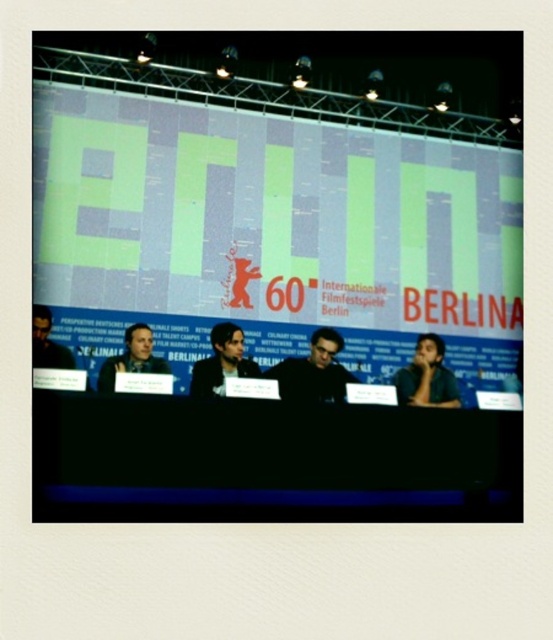
Question: Can you confirm if black plastic table at center is positioned to the right of dark gray fabric jacket at center?

Choices:
 (A) no
 (B) yes

Answer: (A)

Question: Which object appears farthest from the camera in this image?

Choices:
 (A) dark hair person at left
 (B) dark gray fabric jacket at center
 (C) matte black man at left
 (D) dark green shirt at right

Answer: (D)

Question: Does black plastic table at center appear on the left side of dark hair person at left?

Choices:
 (A) yes
 (B) no

Answer: (B)

Question: Does black plastic table at center appear on the right side of matte black man at left?

Choices:
 (A) no
 (B) yes

Answer: (B)

Question: Which of these objects is positioned closest to the dark green shirt at right?

Choices:
 (A) matte black man at left
 (B) dark hair person at left

Answer: (A)

Question: Among these objects, which one is farthest from the camera?

Choices:
 (A) matte black man at left
 (B) black plastic table at center

Answer: (A)